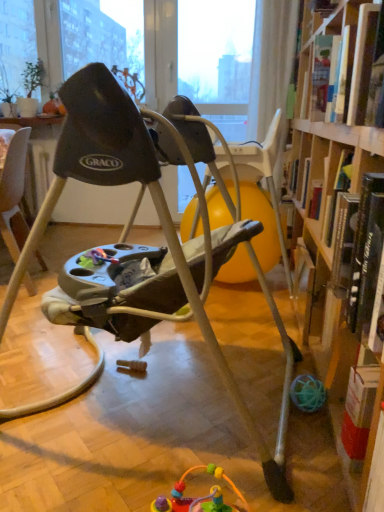
Question: Is hardcover book at upper right, which ranks as the 1th book in top-to-bottom order, in front of or behind hardcover book at right, which is counted as the first book, starting from the bottom, in the image?

Choices:
 (A) front
 (B) behind

Answer: (B)

Question: Is hardcover book at upper right, which ranks as the 2th book in bottom-to-top order, wider or thinner than hardcover book at right, which appears as the second book when viewed from the top?

Choices:
 (A) wide
 (B) thin

Answer: (B)

Question: Which object is the closest to the gray plastic baby swing at center?

Choices:
 (A) hardcover book at upper right, which ranks as the 1th book in top-to-bottom order
 (B) hardcover book at right, which is counted as the first book, starting from the bottom

Answer: (B)

Question: Estimate the real-world distances between objects in this image. Which object is closer to the hardcover book at right, which appears as the second book when viewed from the top?

Choices:
 (A) gray plastic baby swing at center
 (B) hardcover book at upper right, which ranks as the 1th book in top-to-bottom order

Answer: (A)